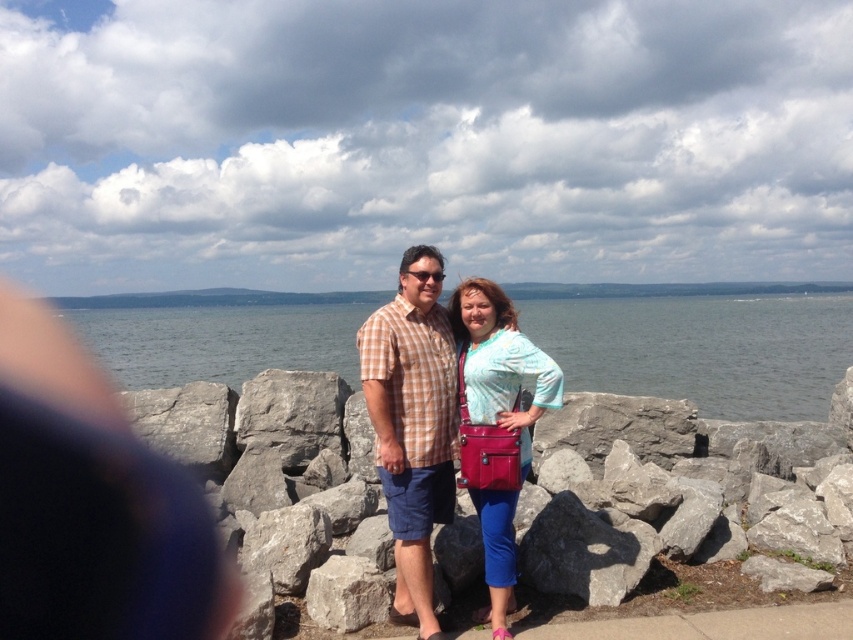
You are standing at the point marked by the coordinates point [701,349] in the image. Looking around, you see gray water at center. What is directly below you?

The point marked by the coordinates point [701,349] is directly above the gray water at center, so you are standing above the gray water at center.

You are a photographer trying to capture a clear shot of both the checkered fabric shirt at center and the matte pink purse at center. Based on their positions, which object might partially block the view of the other?

The matte pink purse at center is behind the checkered fabric shirt at center, so the checkered fabric shirt at center might partially block the view of the matte pink purse at center.